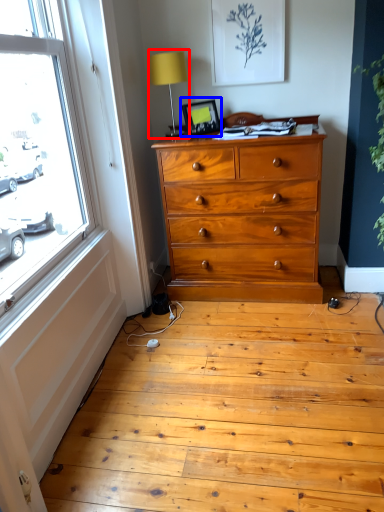
Question: Which of the following is the farthest to the observer, table lamp (highlighted by a red box) or picture frame (highlighted by a blue box)?

Choices:
 (A) table lamp
 (B) picture frame

Answer: (B)